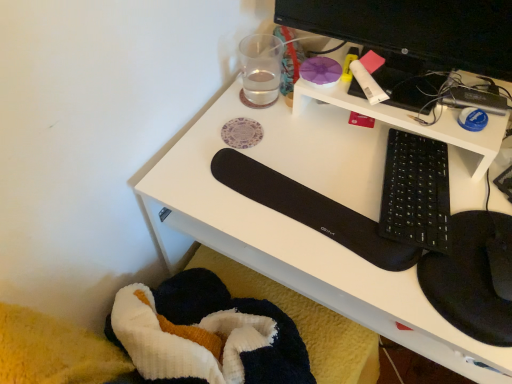
Find the location of `free space in front of transparent glass at upper center, the 1th stationery from the back`. free space in front of transparent glass at upper center, the 1th stationery from the back is located at coordinates (264, 139).